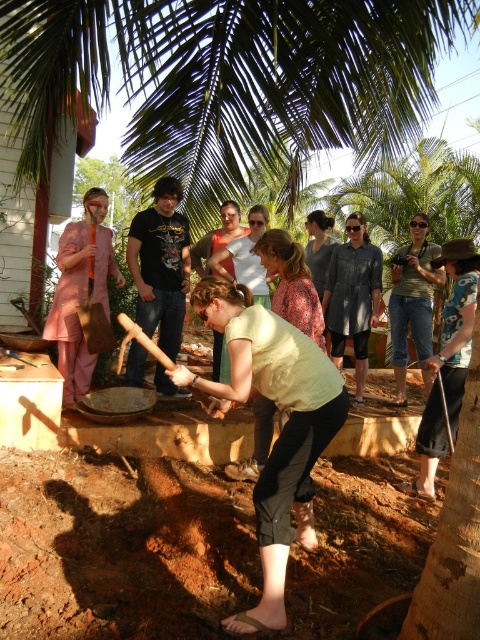
Is point (420, 285) farther from camera compared to point (252, 273)?

That is True.

Who is more distant from viewer, (392, 336) or (236, 266)?

The point (392, 336) is more distant.

Who is more distant from viewer, (420, 257) or (219, 264)?

The point (420, 257) is behind.

Find the location of a particular element. This screenshot has width=480, height=640. denim shorts at center is located at coordinates (412, 301).

From the picture: Which is above, matte pink fabric at left or orange wooden shovel at center?

orange wooden shovel at center is above.

Consider the image. Can you confirm if matte pink fabric at left is bigger than orange wooden shovel at center?

Correct, matte pink fabric at left is larger in size than orange wooden shovel at center.

Between point (68, 275) and point (106, 348), which one is positioned behind?

The point (106, 348) is more distant.

Locate an element on the screen. Image resolution: width=480 pixels, height=640 pixels. matte pink fabric at left is located at coordinates (80, 294).

Which is in front, point (170, 312) or point (91, 204)?

Point (91, 204) is more forward.

Is black t-shirt at center below orange wooden shovel at center?

Correct, black t-shirt at center is located below orange wooden shovel at center.

Is point (175, 284) closer to viewer compared to point (84, 323)?

No, (175, 284) is further to viewer.

Where is `black t-shirt at center`? Image resolution: width=480 pixels, height=640 pixels. black t-shirt at center is located at coordinates (160, 264).